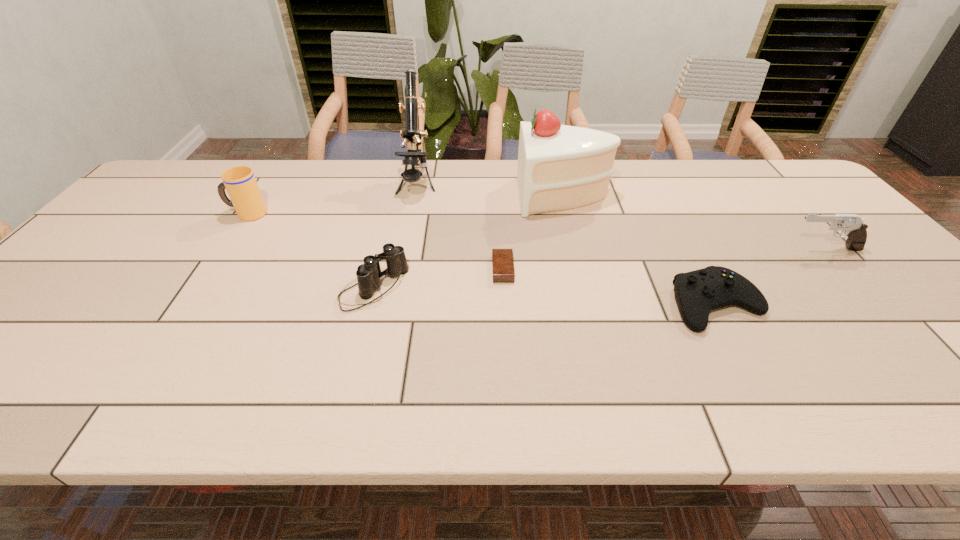
In the image, there is a desktop. At what (x,y) coordinates should I click in order to perform the action: click on vacant region at the left edge. Please return your answer as a coordinate pair (x, y). The image size is (960, 540). Looking at the image, I should click on (172, 220).

In the image, there is a desktop. Where is `free region at the far left corner`? The image size is (960, 540). free region at the far left corner is located at coordinates (179, 185).

This screenshot has height=540, width=960. In order to click on vacant space at the far right corner of the desktop in this screenshot , I will do `click(779, 198)`.

Find the location of a particular element. empty location between the sixth tallest object and the fourth object from left to right is located at coordinates (610, 287).

You are a GUI agent. You are given a task and a screenshot of the screen. Output one action in this format:
    pyautogui.click(x=<x>, y=<y>)
    Task: Click on the empty space that is in between the binoculars and the second tallest object
    Image resolution: width=960 pixels, height=540 pixels.
    Given the screenshot: What is the action you would take?
    pyautogui.click(x=468, y=242)

Identify the location of vacant point located between the fourth object from right to left and the leftmost object. (375, 241).

Identify the location of free spot between the gun and the fifth object from left to right. The height and width of the screenshot is (540, 960). (694, 222).

Identify the location of free space between the cup and the tallest object. (332, 199).

Where is `free space that is in between the fourth shortest object and the sixth object from left to right`? free space that is in between the fourth shortest object and the sixth object from left to right is located at coordinates (770, 276).

This screenshot has width=960, height=540. What are the coordinates of `unoccupied position between the binoculars and the tallest object` in the screenshot? It's located at (396, 237).